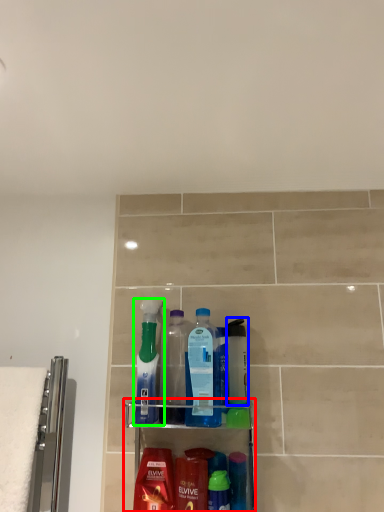
Question: Which is farther away from shelf (highlighted by a red box)? mouthwash (highlighted by a blue box) or bottle (highlighted by a green box)?

Choices:
 (A) mouthwash
 (B) bottle

Answer: (B)